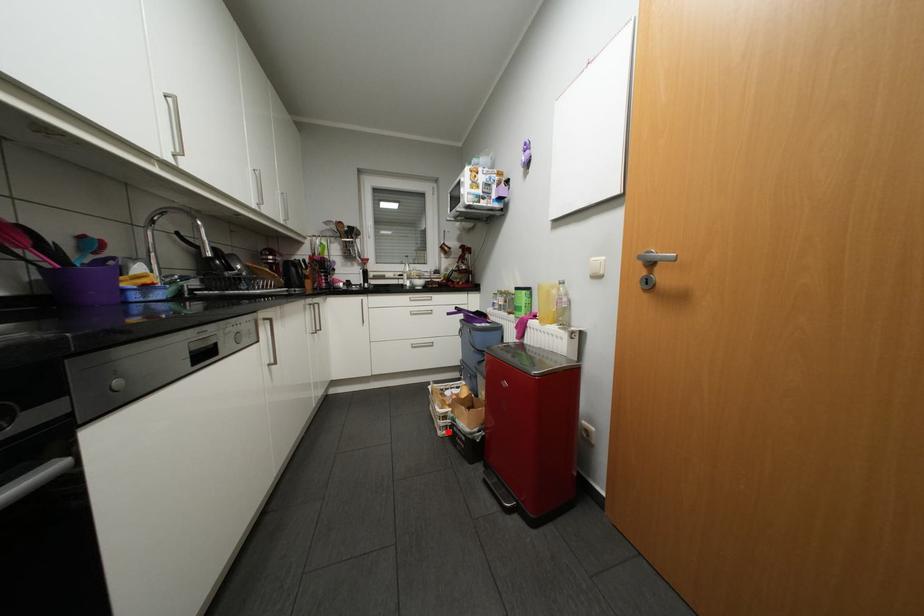
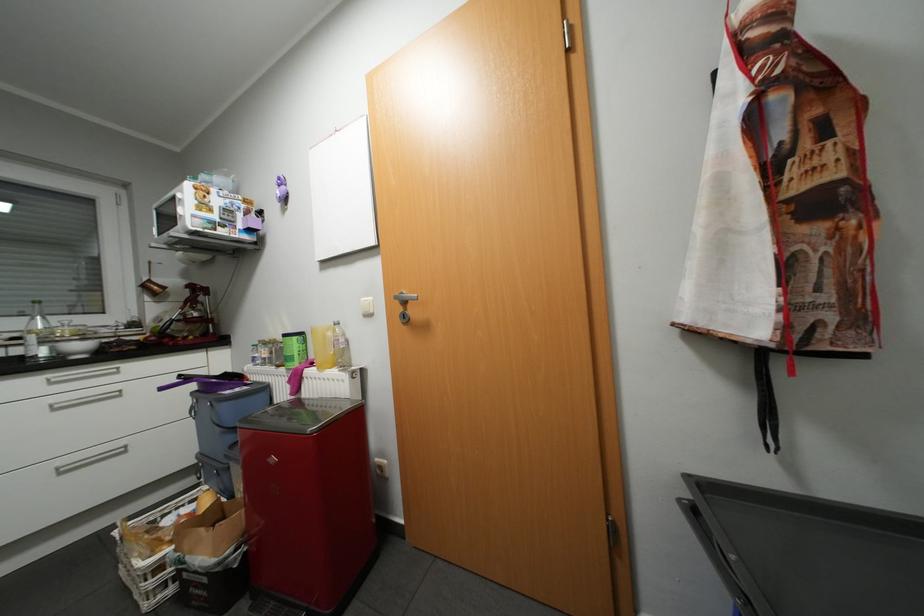
Where in the second image is the point corresponding to the highlighted location from the first image?

(156, 604)